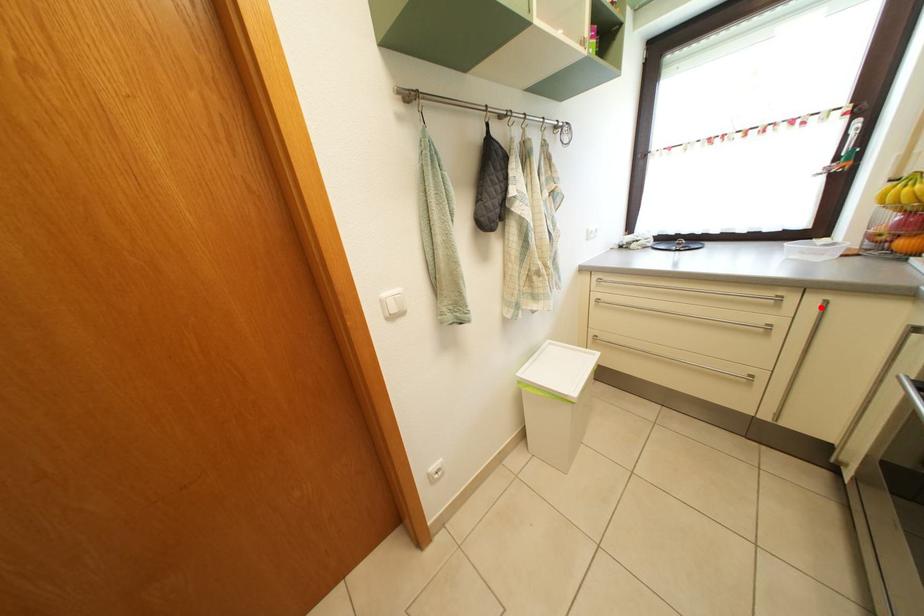
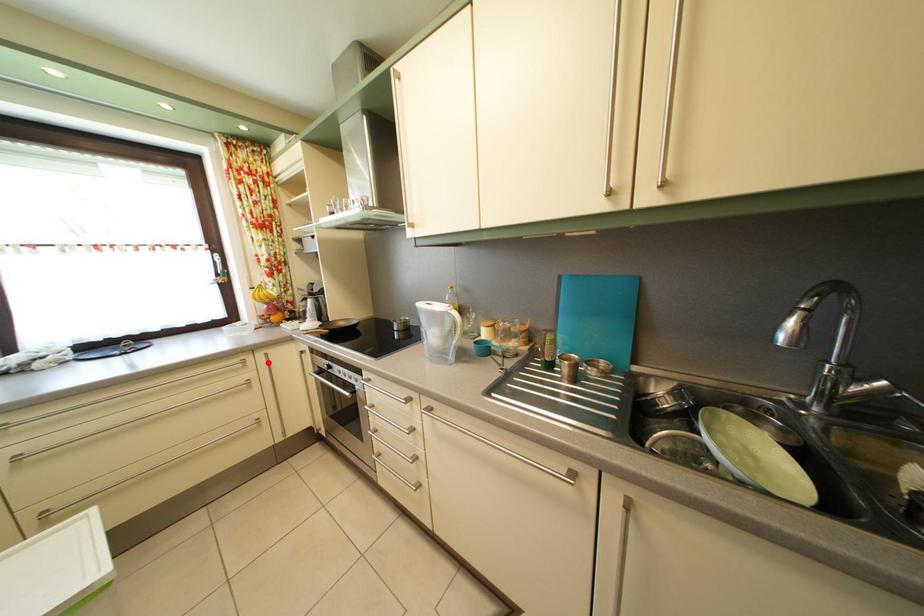
I am providing you with two images of the same scene from different viewpoints. A red point is marked on the first image and another point is marked on the second image. Does the point marked in image1 correspond to the same location as the one in image2?

Yes